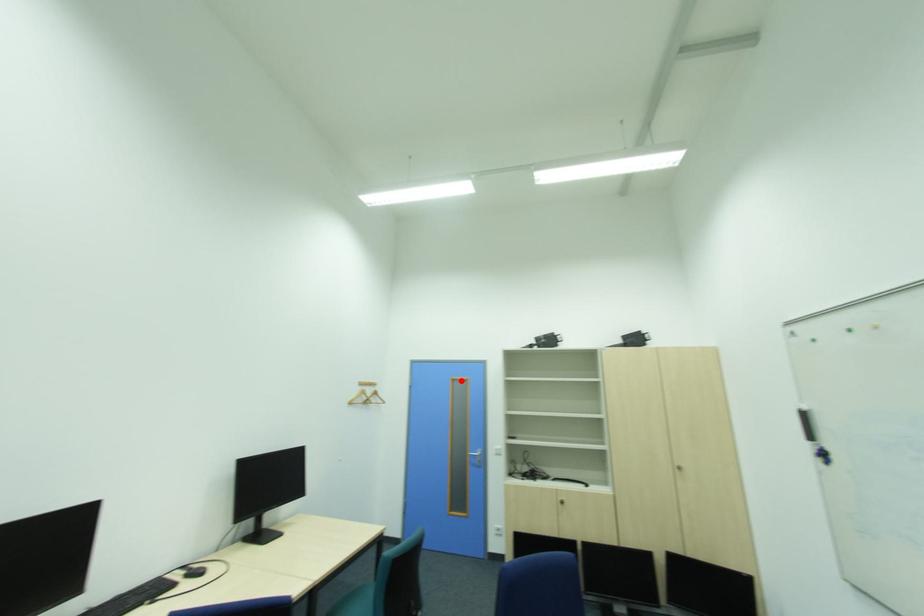
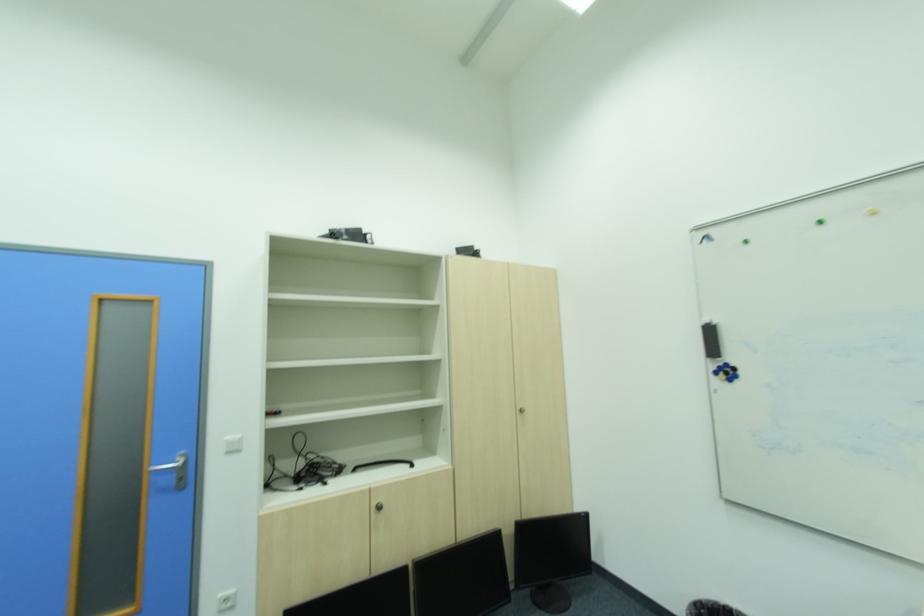
Where in the second image is the point corresponding to the highlighted location from the first image?

(111, 300)